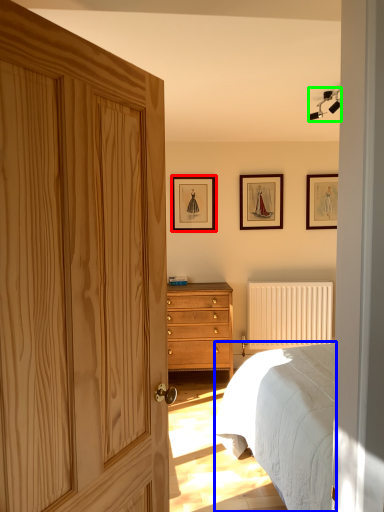
Question: Which object is positioned farthest from picture frame (highlighted by a red box)? Select from bed (highlighted by a blue box) and light fixture (highlighted by a green box).

Choices:
 (A) bed
 (B) light fixture

Answer: (A)